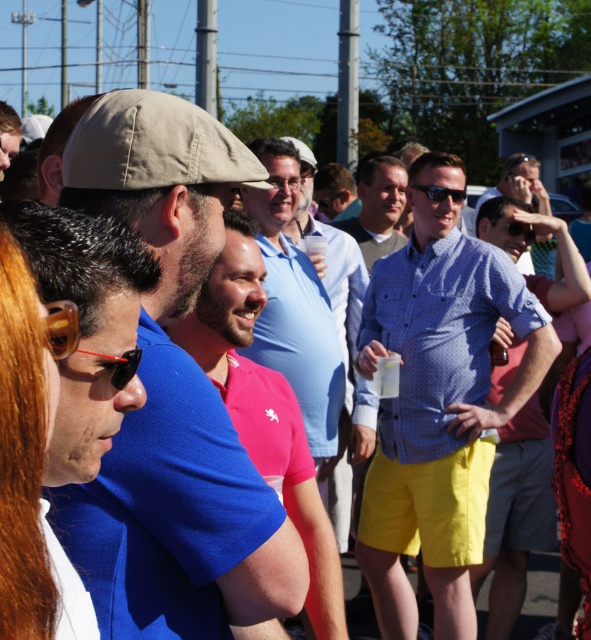
You are at an outdoor event and see the matte black cap at upper left and the matte black sunglasses at center. Which object is located more to the left?

The matte black cap at upper left is more to the left than the matte black sunglasses at center.

You are at the gathering and want to take a photo of both the point at coordinates (73,176) and the point at coordinates (437,189). Which point should you focus on first to ensure both are in the frame?

You should focus on point (73,176) first because it is in front of point (437,189), so focusing on the closer point will keep both in focus.